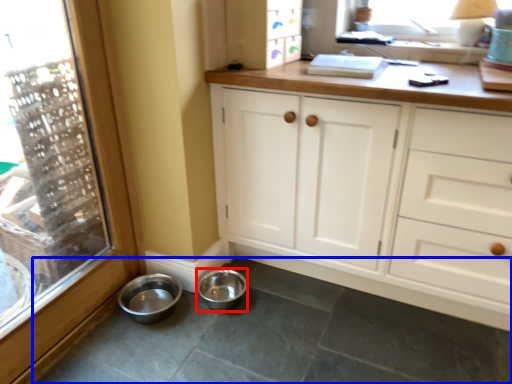
Question: Among these objects, which one is nearest to the camera, basin (highlighted by a red box) or concrete (highlighted by a blue box)?

Choices:
 (A) basin
 (B) concrete

Answer: (B)